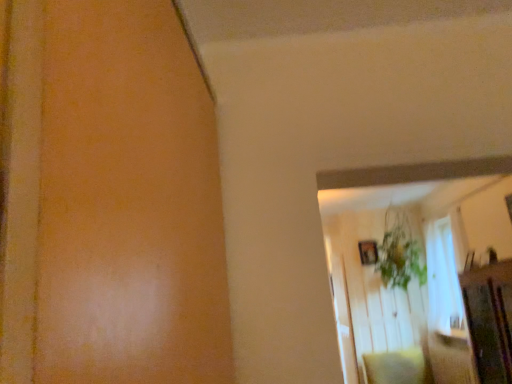
Question: Looking at the image, does wooden picture frame at upper right seem bigger or smaller compared to soft beige pillow at lower right?

Choices:
 (A) small
 (B) big

Answer: (A)

Question: Relative to soft beige pillow at lower right, is wooden picture frame at upper right in front or behind?

Choices:
 (A) behind
 (B) front

Answer: (A)

Question: Estimate the real-world distances between objects in this image. Which object is farther from the soft beige pillow at lower right?

Choices:
 (A) green leafy plant at upper center
 (B) wooden picture frame at upper right

Answer: (B)

Question: Which is farther from the soft beige pillow at lower right?

Choices:
 (A) wooden picture frame at upper right
 (B) green leafy plant at upper center

Answer: (A)